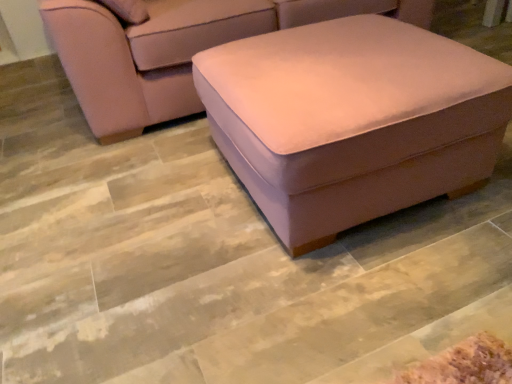
Question: Based on their sizes in the image, would you say suede-like pink ottoman at center is bigger or smaller than suede-like beige ottoman at center?

Choices:
 (A) big
 (B) small

Answer: (B)

Question: Is suede-like pink ottoman at center inside the boundaries of suede-like beige ottoman at center, or outside?

Choices:
 (A) outside
 (B) inside

Answer: (A)

Question: Looking at their shapes, would you say suede-like pink ottoman at center is wider or thinner than suede-like beige ottoman at center?

Choices:
 (A) wide
 (B) thin

Answer: (B)

Question: Considering the relative positions of suede-like beige ottoman at center and suede-like pink ottoman at center in the image provided, is suede-like beige ottoman at center to the left or to the right of suede-like pink ottoman at center?

Choices:
 (A) left
 (B) right

Answer: (A)

Question: Is suede-like beige ottoman at center inside the boundaries of suede-like pink ottoman at center, or outside?

Choices:
 (A) inside
 (B) outside

Answer: (B)

Question: From the image's perspective, is suede-like beige ottoman at center above or below suede-like pink ottoman at center?

Choices:
 (A) below
 (B) above

Answer: (B)

Question: From their relative heights in the image, would you say suede-like beige ottoman at center is taller or shorter than suede-like pink ottoman at center?

Choices:
 (A) tall
 (B) short

Answer: (A)